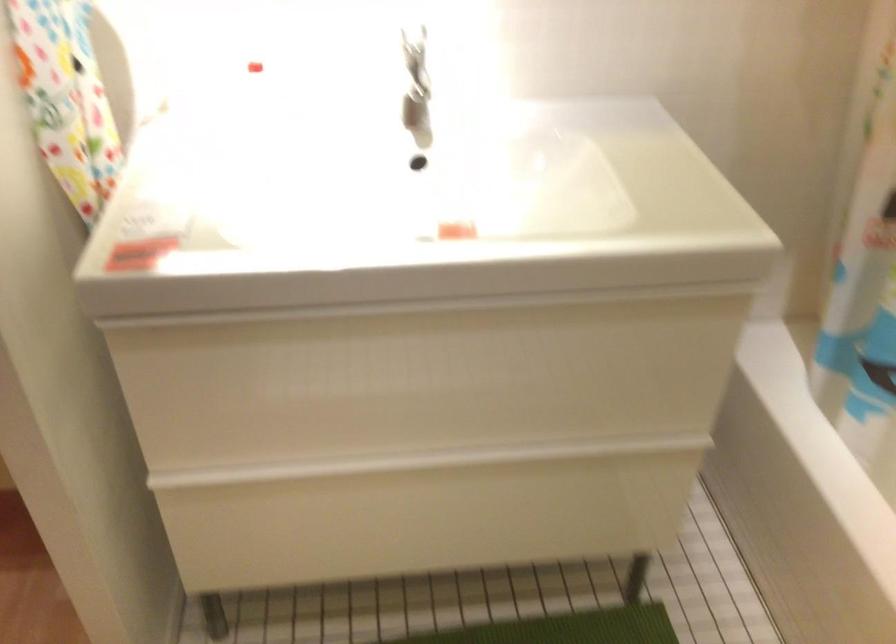
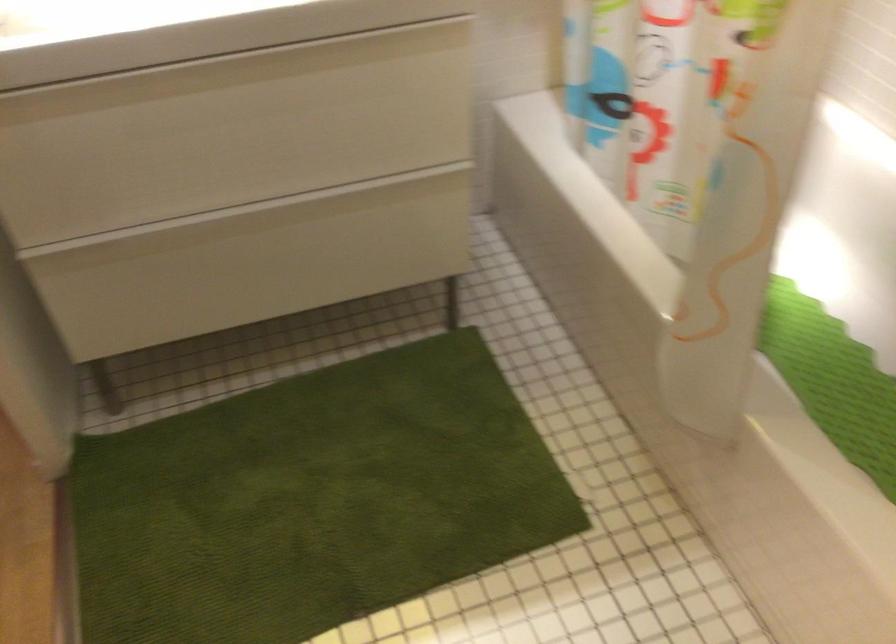
The point at (467,494) is marked in the first image. Where is the corresponding point in the second image?

(289, 238)